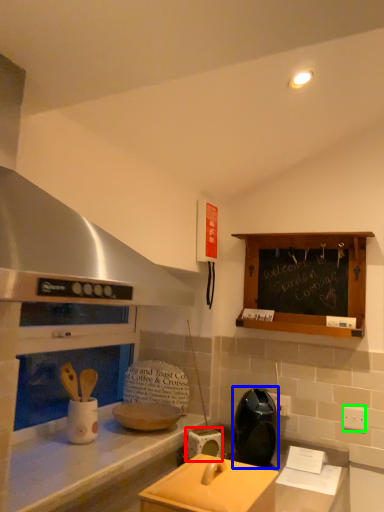
Question: Considering the real-world distances, which object is closest to appliance (highlighted by a red box)? appliance (highlighted by a blue box) or electric outlet (highlighted by a green box).

Choices:
 (A) appliance
 (B) electric outlet

Answer: (A)